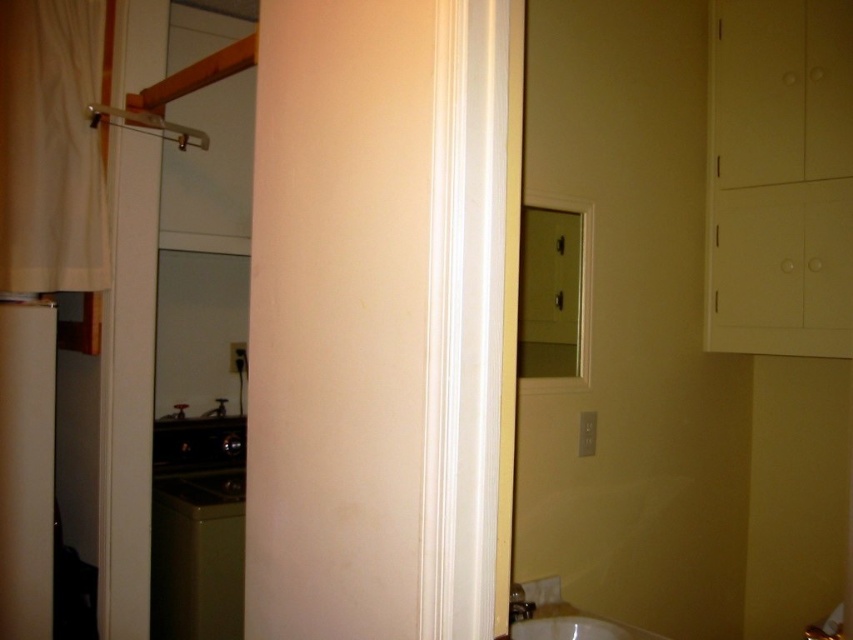
In the scene shown: You are trying to hang a new curtain rod in the bathroom. The current white fabric curtain at left is already installed at point 0.231, 0.061. Where should you place the rod to ensure the curtain hangs properly?

The white fabric curtain at left is located at point [51,147], so you should place the rod at that coordinate to ensure proper hanging.

You are a home inspector checking the bathroom layout. The white glossy sink at lower center and the clear plastic shower at upper left are both in the bathroom. Which one has a greater height?

The white glossy sink at lower center is much taller than the clear plastic shower at upper left, so the white glossy sink at lower center has a greater height.

You are a delivery person who just arrived at the house. You need to place a 1.5 meter long package between the white fabric curtain at left and the white glossy sink at lower center. Can you fit it there?

The distance between the white fabric curtain at left and the white glossy sink at lower center is 1.47 meters, which is shorter than the 1.5 meter package. Therefore, the package cannot fit between them.